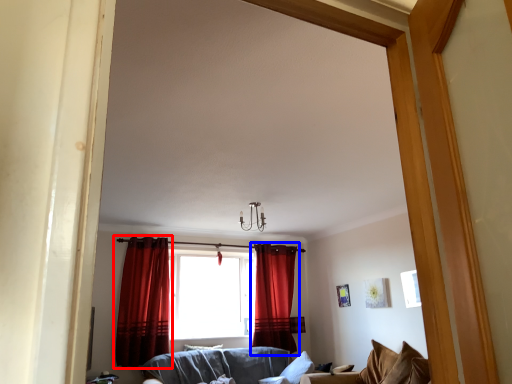
Question: Which object appears farthest to the camera in this image, curtain (highlighted by a red box) or curtain (highlighted by a blue box)?

Choices:
 (A) curtain
 (B) curtain

Answer: (B)